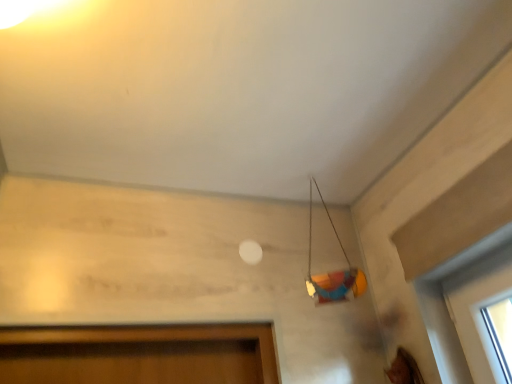
This screenshot has height=384, width=512. What do you see at coordinates (332, 272) in the screenshot?
I see `multicolored plastic toy at upper right` at bounding box center [332, 272].

Locate an element on the screen. The height and width of the screenshot is (384, 512). multicolored plastic toy at upper right is located at coordinates (332, 272).

Locate an element on the screen. multicolored plastic toy at upper right is located at coordinates (332, 272).